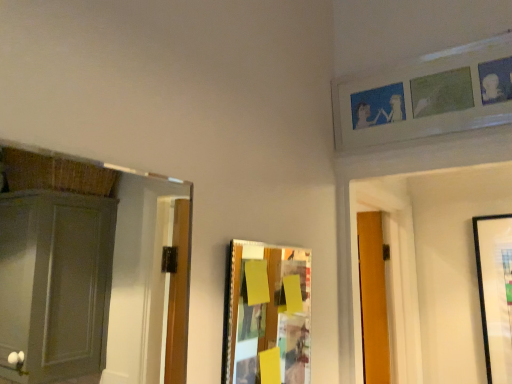
Measure the distance between point (262, 304) and camera.

The distance of point (262, 304) from camera is 78.50 centimeters.

The width and height of the screenshot is (512, 384). What do you see at coordinates (268, 315) in the screenshot?
I see `wooden collage board at center, the second picture frame from the back` at bounding box center [268, 315].

Identify the location of wooden collage board at center, the 2th picture frame positioned from the top. (268, 315).

What do you see at coordinates (426, 96) in the screenshot? This screenshot has height=384, width=512. I see `white matte picture frame at upper right, which is counted as the 2th picture frame, starting from the left` at bounding box center [426, 96].

Measure the distance between point (374, 73) and camera.

The distance of point (374, 73) from camera is 3.84 feet.

The image size is (512, 384). In order to click on white matte picture frame at upper right, marked as the 2th picture frame in a front-to-back arrangement in this screenshot , I will do `click(426, 96)`.

Identify the location of wooden collage board at center, the second picture frame from the back. (268, 315).

In the image, is white matte picture frame at upper right, marked as the first picture frame in a top-to-bottom arrangement, on the left side or the right side of wooden collage board at center, marked as the first picture frame in a front-to-back arrangement?

Based on their positions, white matte picture frame at upper right, marked as the first picture frame in a top-to-bottom arrangement, is located to the right of wooden collage board at center, marked as the first picture frame in a front-to-back arrangement.

Which object is closer to the camera taking this photo, white matte picture frame at upper right, arranged as the first picture frame when viewed from the right, or wooden collage board at center, the second picture frame from the back?

wooden collage board at center, the second picture frame from the back, is in front.

Does point (355, 110) appear closer or farther from the camera than point (234, 270)?

Point (355, 110) is farther from the camera than point (234, 270).

From the image's perspective, which one is positioned higher, white matte picture frame at upper right, placed as the 2th picture frame when sorted from bottom to top, or wooden collage board at center, which ranks as the 2th picture frame in right-to-left order?

white matte picture frame at upper right, placed as the 2th picture frame when sorted from bottom to top, appears higher in the image.

From a real-world perspective, which object stands above the other?

In real-world perspective, white matte picture frame at upper right, arranged as the first picture frame when viewed from the right, is above.

Considering the sizes of objects white matte picture frame at upper right, arranged as the first picture frame when viewed from the right, and wooden collage board at center, marked as the first picture frame in a front-to-back arrangement, in the image provided, who is wider, white matte picture frame at upper right, arranged as the first picture frame when viewed from the right, or wooden collage board at center, marked as the first picture frame in a front-to-back arrangement,?

With larger width is white matte picture frame at upper right, arranged as the first picture frame when viewed from the right.

Does white matte picture frame at upper right, marked as the first picture frame in a top-to-bottom arrangement, have a greater height compared to wooden collage board at center, marked as the first picture frame in a front-to-back arrangement?

Incorrect, the height of white matte picture frame at upper right, marked as the first picture frame in a top-to-bottom arrangement, is not larger of that of wooden collage board at center, marked as the first picture frame in a front-to-back arrangement.

Looking at the image, does white matte picture frame at upper right, placed as the 2th picture frame when sorted from bottom to top, seem bigger or smaller compared to wooden collage board at center, marked as the first picture frame in a bottom-to-top arrangement?

Considering their sizes, white matte picture frame at upper right, placed as the 2th picture frame when sorted from bottom to top, takes up more space than wooden collage board at center, marked as the first picture frame in a bottom-to-top arrangement.

Could wooden collage board at center, the second picture frame from the back, be considered to be inside white matte picture frame at upper right, positioned as the 1th picture frame in back-to-front order?

No, white matte picture frame at upper right, positioned as the 1th picture frame in back-to-front order, does not contain wooden collage board at center, the second picture frame from the back.

Is white matte picture frame at upper right, which is counted as the 2th picture frame, starting from the left, far from wooden collage board at center, marked as the first picture frame in a bottom-to-top arrangement?

No.

Could you tell me if white matte picture frame at upper right, positioned as the 1th picture frame in back-to-front order, is turned towards wooden collage board at center, the first picture frame when ordered from left to right?

No, white matte picture frame at upper right, positioned as the 1th picture frame in back-to-front order, is not oriented towards wooden collage board at center, the first picture frame when ordered from left to right.

What's the angular difference between white matte picture frame at upper right, arranged as the first picture frame when viewed from the right, and wooden collage board at center, the first picture frame when ordered from left to right,'s facing directions?

white matte picture frame at upper right, arranged as the first picture frame when viewed from the right, and wooden collage board at center, the first picture frame when ordered from left to right, are facing 89.3 degrees away from each other.

Measure the distance between white matte picture frame at upper right, which is counted as the 2th picture frame, starting from the left, and wooden collage board at center, marked as the first picture frame in a front-to-back arrangement.

They are 20.63 inches apart.

Locate an element on the screen. picture frame located behind the wooden collage board at center, marked as the first picture frame in a front-to-back arrangement is located at coordinates (426, 96).

Considering the positions of objects wooden collage board at center, the second picture frame from the back, and white matte picture frame at upper right, which is counted as the 2th picture frame, starting from the left, in the image provided, who is more to the left, wooden collage board at center, the second picture frame from the back, or white matte picture frame at upper right, which is counted as the 2th picture frame, starting from the left,?

Positioned to the left is wooden collage board at center, the second picture frame from the back.

Does wooden collage board at center, the 2th picture frame positioned from the top, lie behind white matte picture frame at upper right, marked as the 2th picture frame in a front-to-back arrangement?

No, it is in front of white matte picture frame at upper right, marked as the 2th picture frame in a front-to-back arrangement.

Based on the photo, which point is more distant from viewer, (302, 296) or (475, 123)?

Point (475, 123)

From the image's perspective, is wooden collage board at center, marked as the first picture frame in a front-to-back arrangement, located above or below white matte picture frame at upper right, positioned as the 1th picture frame in back-to-front order?

Clearly, from the image's perspective, wooden collage board at center, marked as the first picture frame in a front-to-back arrangement, is below white matte picture frame at upper right, positioned as the 1th picture frame in back-to-front order.

From a real-world perspective, is wooden collage board at center, marked as the first picture frame in a front-to-back arrangement, physically below white matte picture frame at upper right, marked as the 2th picture frame in a front-to-back arrangement?

Yes, from a real-world perspective, wooden collage board at center, marked as the first picture frame in a front-to-back arrangement, is under white matte picture frame at upper right, marked as the 2th picture frame in a front-to-back arrangement.

Can you confirm if wooden collage board at center, marked as the first picture frame in a bottom-to-top arrangement, is thinner than white matte picture frame at upper right, which is counted as the 2th picture frame, starting from the left?

Yes.

Does wooden collage board at center, the second picture frame from the back, have a greater height compared to white matte picture frame at upper right, placed as the 2th picture frame when sorted from bottom to top?

Indeed, wooden collage board at center, the second picture frame from the back, has a greater height compared to white matte picture frame at upper right, placed as the 2th picture frame when sorted from bottom to top.

In terms of size, does wooden collage board at center, the first picture frame when ordered from left to right, appear bigger or smaller than white matte picture frame at upper right, marked as the 2th picture frame in a front-to-back arrangement?

Considering their sizes, wooden collage board at center, the first picture frame when ordered from left to right, takes up less space than white matte picture frame at upper right, marked as the 2th picture frame in a front-to-back arrangement.

Can we say wooden collage board at center, marked as the first picture frame in a bottom-to-top arrangement, lies outside white matte picture frame at upper right, which is counted as the 2th picture frame, starting from the left?

wooden collage board at center, marked as the first picture frame in a bottom-to-top arrangement, is positioned outside white matte picture frame at upper right, which is counted as the 2th picture frame, starting from the left.

Is wooden collage board at center, the first picture frame when ordered from left to right, touching white matte picture frame at upper right, placed as the 2th picture frame when sorted from bottom to top?

No, wooden collage board at center, the first picture frame when ordered from left to right, is not beside white matte picture frame at upper right, placed as the 2th picture frame when sorted from bottom to top.

Could you tell me if wooden collage board at center, marked as the first picture frame in a bottom-to-top arrangement, is turned towards white matte picture frame at upper right, arranged as the first picture frame when viewed from the right?

No, wooden collage board at center, marked as the first picture frame in a bottom-to-top arrangement, is not facing towards white matte picture frame at upper right, arranged as the first picture frame when viewed from the right.

How different are the orientations of wooden collage board at center, marked as the first picture frame in a bottom-to-top arrangement, and white matte picture frame at upper right, marked as the first picture frame in a top-to-bottom arrangement, in degrees?

wooden collage board at center, marked as the first picture frame in a bottom-to-top arrangement, and white matte picture frame at upper right, marked as the first picture frame in a top-to-bottom arrangement, are facing 89.3 degrees away from each other.

Locate an element on the screen. The image size is (512, 384). picture frame lying in front of the white matte picture frame at upper right, marked as the 2th picture frame in a front-to-back arrangement is located at coordinates (268, 315).

Locate an element on the screen. The width and height of the screenshot is (512, 384). picture frame on the left of white matte picture frame at upper right, marked as the first picture frame in a top-to-bottom arrangement is located at coordinates (268, 315).

Find the location of a particular element. This screenshot has width=512, height=384. picture frame located above the wooden collage board at center, the 2th picture frame positioned from the top (from the image's perspective) is located at coordinates (426, 96).